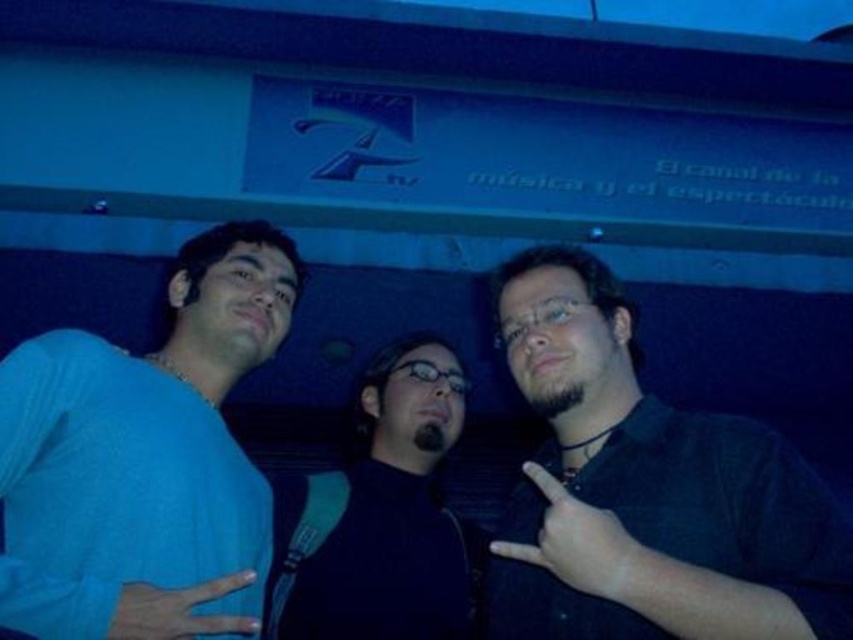
You are a photographer adjusting the focus on your camera. You want to focus on the person on the right who is making a peace sign. The focus points available are at point coordinates point (160, 541) and point (428, 419). Which focus point should you choose to ensure the person on the right is in focus?

Point (160, 541) is closer to the camera than point (428, 419), so you should choose point (160, 541) to focus on the person on the right who is making a peace sign.

Based on the coordinates provided, which object is located at point (x=647, y=492) in the image?

The dark green shirt at center is located at point (x=647, y=492).